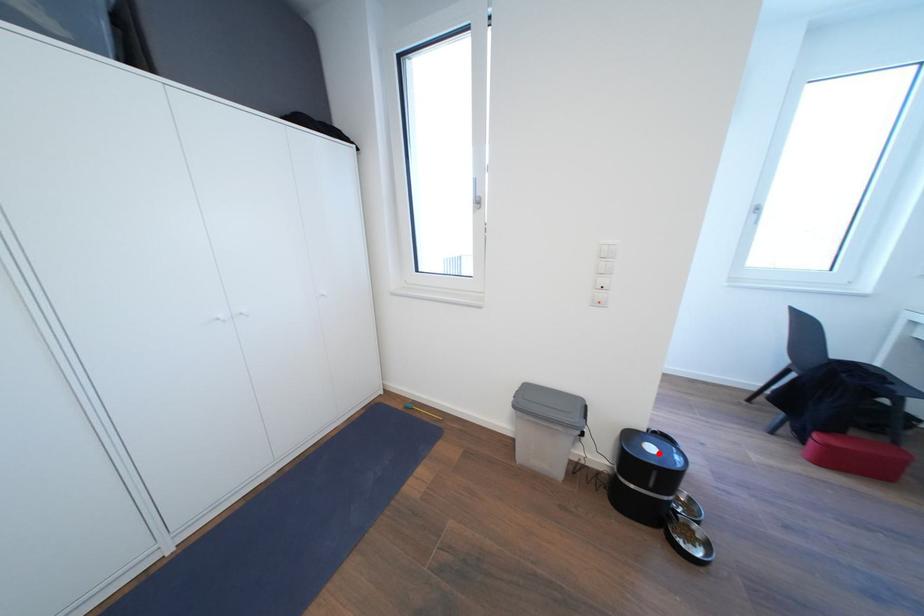
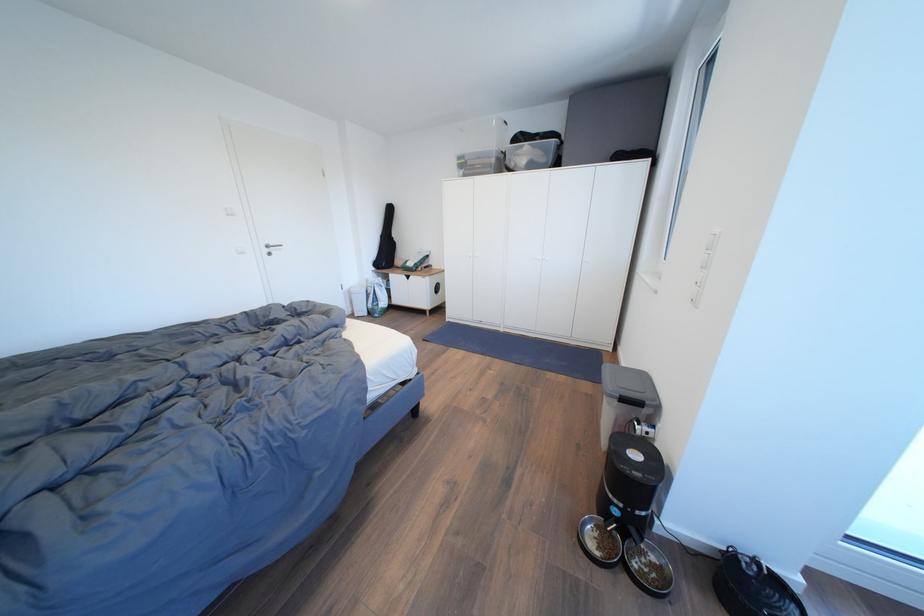
Question: A red point is marked in image1. In image2, is the corresponding 3D point closer to the camera or farther? Reply with the corresponding letter.

Choices:
 (A) The corresponding 3D point is closer.
 (B) The corresponding 3D point is farther.

Answer: (A)